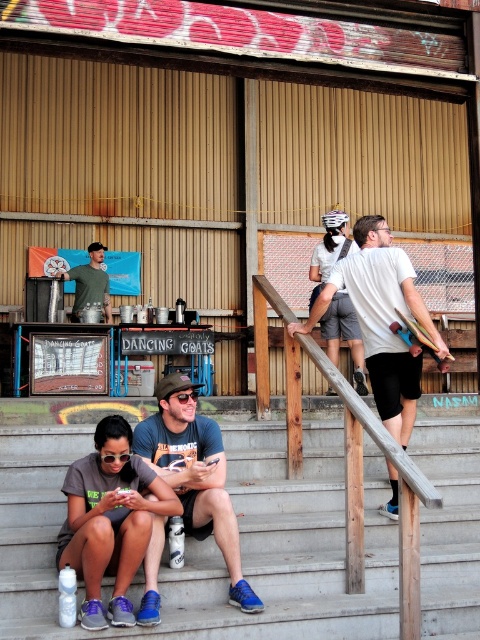
Question: Where is gray wooden stairs at lower center located in relation to wooden skateboard at upper right in the image?

Choices:
 (A) left
 (B) right

Answer: (A)

Question: Based on their relative distances, which object is nearer to the gray wooden stairs at lower center?

Choices:
 (A) white matte skateboard at upper right
 (B) matte blue shorts at lower center
 (C) matte black shirt at center

Answer: (B)

Question: Which is farther from the matte black skateboard at lower left?

Choices:
 (A) gray wooden stairs at lower center
 (B) matte black shirt at center
 (C) white matte skateboard at upper right

Answer: (B)

Question: Which point is closer to the camera?

Choices:
 (A) (90, 282)
 (B) (143, 440)

Answer: (B)

Question: Can you confirm if matte blue shorts at lower center is positioned below wooden skateboard at upper right?

Choices:
 (A) yes
 (B) no

Answer: (A)

Question: Is gray wooden stairs at lower center wider than wooden skateboard at upper right?

Choices:
 (A) no
 (B) yes

Answer: (B)